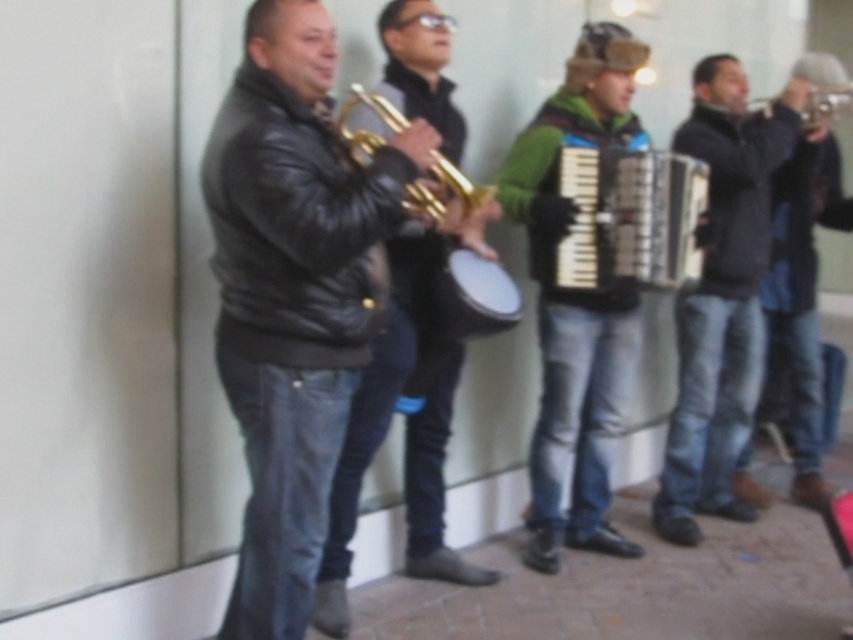
You are standing at the center of the scene. Which of the two points, point (x=351, y=148) or point (x=801, y=118), is closer to you?

Point (x=351, y=148) is closer to you because it is in front of point (x=801, y=118).

From the picture: You are a photographer standing in front of the group. You want to take a photo that includes both the dark blue jeans at center and the gold shiny trumpet at center. Which object will appear larger in the photo?

The dark blue jeans at center will appear larger in the photo because it is closer to the viewer than the gold shiny trumpet at center.